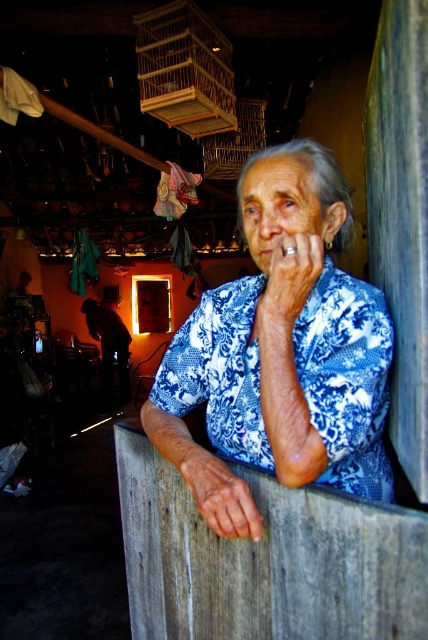
Does point (338, 352) come farther from viewer compared to point (210, 522)?

Yes, it is.

What do you see at coordinates (281, 353) in the screenshot? This screenshot has width=428, height=640. I see `blue printed shirt at center` at bounding box center [281, 353].

Image resolution: width=428 pixels, height=640 pixels. In order to click on blue printed shirt at center in this screenshot , I will do `click(281, 353)`.

Who is positioned more to the right, blue printed shirt at center or matte blue fabric at center?

Positioned to the right is blue printed shirt at center.

Does blue printed shirt at center lie in front of matte blue fabric at center?

Yes, it is.

At what (x,y) coordinates should I click in order to perform the action: click on blue printed shirt at center. Please return your answer as a coordinate pair (x, y). The width and height of the screenshot is (428, 640). Looking at the image, I should click on (281, 353).

Does blue fabric hand at center have a larger size compared to matte blue fabric at center?

Yes.

Who is more distant from viewer, (199,506) or (320,273)?

The point (320,273) is behind.

Measure the distance between point (231, 506) and camera.

Point (231, 506) and camera are 85.16 centimeters apart from each other.

At what (x,y) coordinates should I click in order to perform the action: click on blue fabric hand at center. Please return your answer as a coordinate pair (x, y). Image resolution: width=428 pixels, height=640 pixels. Looking at the image, I should click on (219, 493).